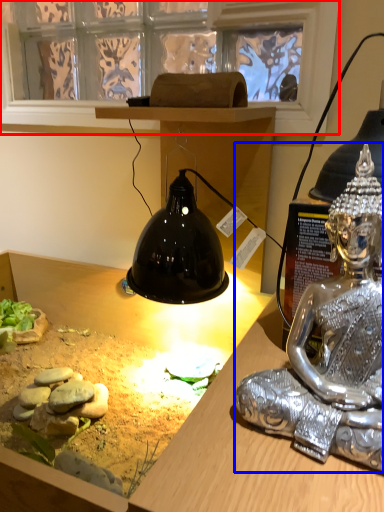
Question: Which point is closer to the camera, window screen (highlighted by a red box) or person (highlighted by a blue box)?

Choices:
 (A) window screen
 (B) person

Answer: (B)